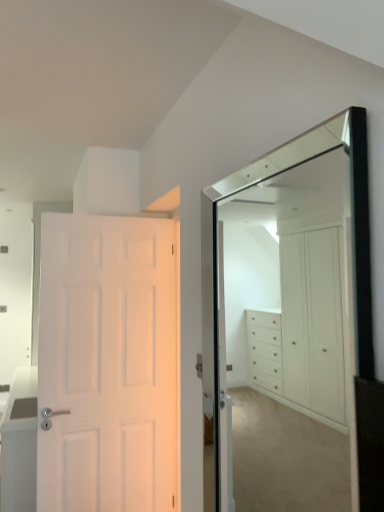
Question: From the image's perspective, is white glossy cabinet at left above clear glass mirror at upper right?

Choices:
 (A) yes
 (B) no

Answer: (B)

Question: Does white glossy cabinet at left have a smaller size compared to clear glass mirror at upper right?

Choices:
 (A) no
 (B) yes

Answer: (A)

Question: Could you tell me if white glossy cabinet at left is facing clear glass mirror at upper right?

Choices:
 (A) no
 (B) yes

Answer: (A)

Question: From a real-world perspective, is white glossy cabinet at left on top of clear glass mirror at upper right?

Choices:
 (A) yes
 (B) no

Answer: (B)

Question: Is white glossy cabinet at left bigger than clear glass mirror at upper right?

Choices:
 (A) yes
 (B) no

Answer: (A)

Question: From the image's perspective, is white glossy cabinet at left positioned above or below clear glass mirror at upper right?

Choices:
 (A) below
 (B) above

Answer: (A)

Question: From a real-world perspective, relative to clear glass mirror at upper right, is white glossy cabinet at left vertically above or below?

Choices:
 (A) below
 (B) above

Answer: (A)

Question: Choose the correct answer: Is white glossy cabinet at left inside clear glass mirror at upper right or outside it?

Choices:
 (A) outside
 (B) inside

Answer: (A)

Question: Is white glossy cabinet at left wider or thinner than clear glass mirror at upper right?

Choices:
 (A) thin
 (B) wide

Answer: (B)

Question: From a real-world perspective, relative to white glossy cabinet at left, is white matte door at left vertically above or below?

Choices:
 (A) below
 (B) above

Answer: (B)

Question: Considering the positions of white matte door at left and white glossy cabinet at left in the image, is white matte door at left taller or shorter than white glossy cabinet at left?

Choices:
 (A) short
 (B) tall

Answer: (B)

Question: Which is correct: white matte door at left is inside white glossy cabinet at left, or outside of it?

Choices:
 (A) inside
 (B) outside

Answer: (B)

Question: In terms of size, does white matte door at left appear bigger or smaller than white glossy cabinet at left?

Choices:
 (A) small
 (B) big

Answer: (A)

Question: From a real-world perspective, is white matte door at left positioned above or below clear glass mirror at upper right?

Choices:
 (A) above
 (B) below

Answer: (B)

Question: From the image's perspective, is white matte door at left located above or below clear glass mirror at upper right?

Choices:
 (A) above
 (B) below

Answer: (B)